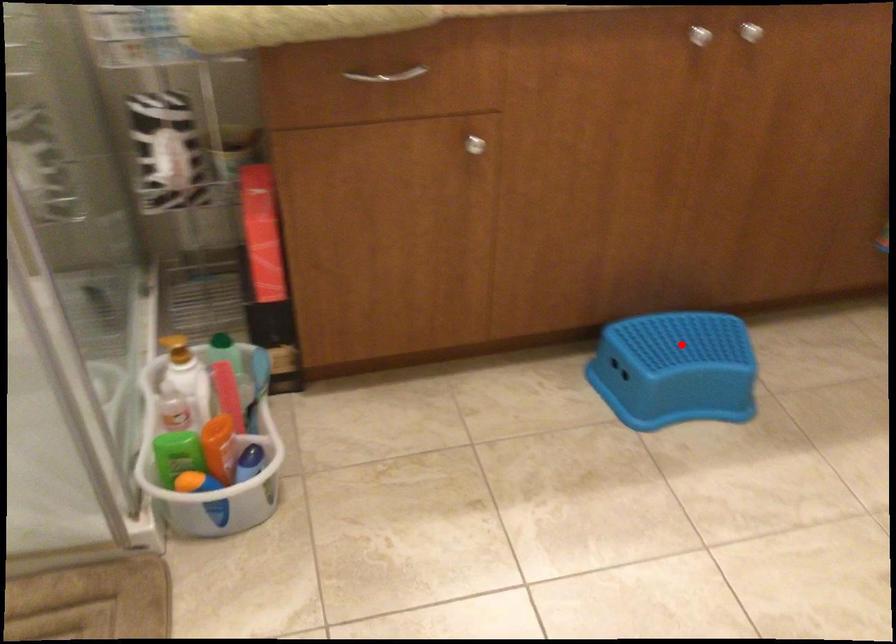
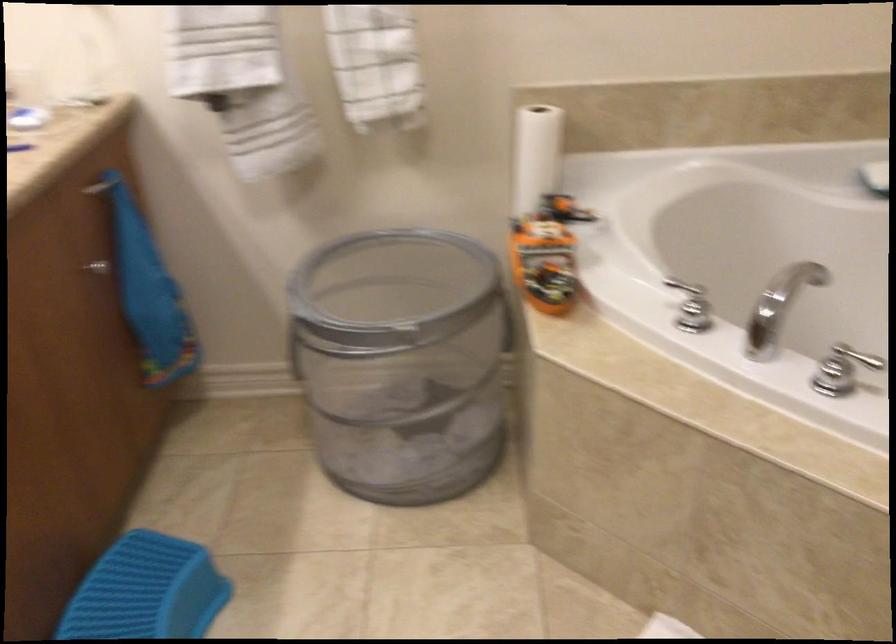
Question: I am providing you with two images of the same scene from different viewpoints. Image1 has a red point marked. In image2, the corresponding 3D location appears at what relative position? Reply with the corresponding letter.

Choices:
 (A) Closer
 (B) Farther

Answer: (A)